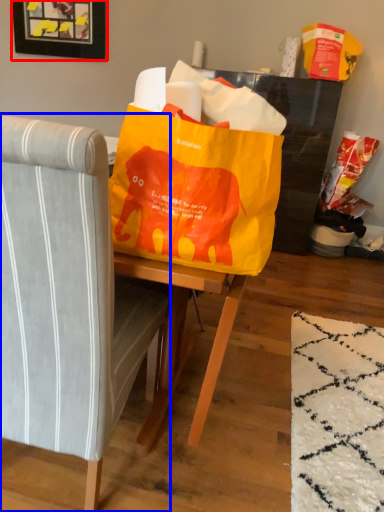
Question: Which of the following is the farthest to the observer, picture frame (highlighted by a red box) or chair (highlighted by a blue box)?

Choices:
 (A) picture frame
 (B) chair

Answer: (A)